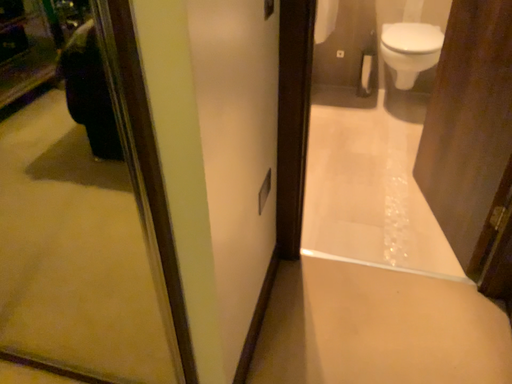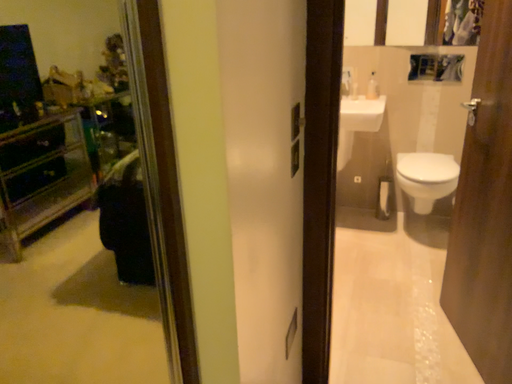
Question: How did the camera likely rotate when shooting the video?

Choices:
 (A) rotated downward
 (B) rotated upward

Answer: (B)